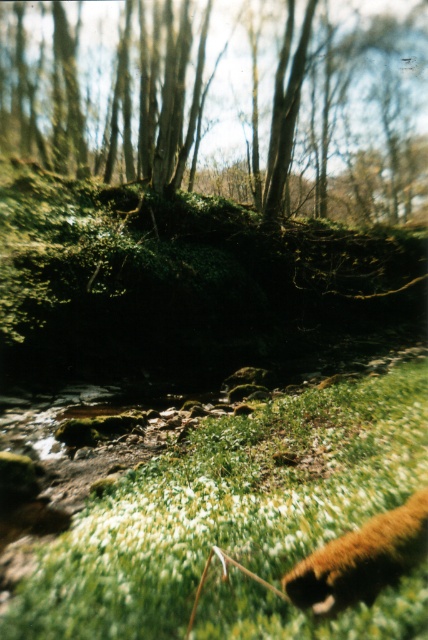
Does point (288, 630) come behind point (374, 531)?

No, (288, 630) is closer to viewer.

Does green grassy at lower center come in front of brown furry animal at lower right?

Yes.

This screenshot has height=640, width=428. Identify the location of green grassy at lower center. (228, 508).

You are a GUI agent. You are given a task and a screenshot of the screen. Output one action in this format:
    pyautogui.click(x=<x>, y=<y>)
    Task: Click on the green grassy at lower center
    
    Given the screenshot: What is the action you would take?
    pyautogui.click(x=228, y=508)

Who is lower down, green mossy tree at upper center or brown furry animal at lower right?

brown furry animal at lower right

This screenshot has width=428, height=640. What do you see at coordinates (225, 102) in the screenshot?
I see `green mossy tree at upper center` at bounding box center [225, 102].

You are a GUI agent. You are given a task and a screenshot of the screen. Output one action in this format:
    pyautogui.click(x=<x>, y=<y>)
    Task: Click on the green mossy tree at upper center
    
    Given the screenshot: What is the action you would take?
    pyautogui.click(x=225, y=102)

Who is more forward, [398,68] or [237,586]?

Point [237,586] is more forward.

Can you confirm if green mossy tree at upper center is wider than green grassy at lower center?

Yes.

Locate an element on the screen. This screenshot has height=640, width=428. green mossy tree at upper center is located at coordinates (225, 102).

Identify the location of green mossy tree at upper center. (225, 102).